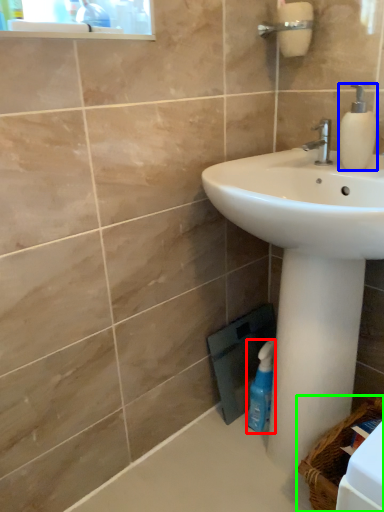
Question: Considering the real-world distances, which object is closest to cleaning product (highlighted by a red box)? soap dispenser (highlighted by a blue box) or basket (highlighted by a green box).

Choices:
 (A) soap dispenser
 (B) basket

Answer: (B)